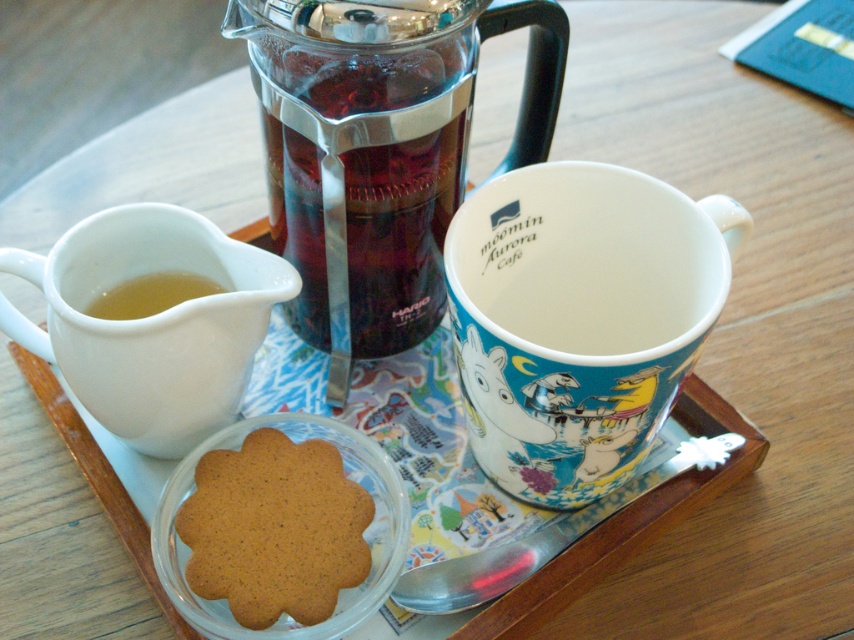
Is point (110, 273) less distant than point (143, 285)?

Yes, it is in front of point (143, 285).

Consider the image. Does white ceramic mug at lower left appear on the right side of translucent glass cup at lower left?

Yes, white ceramic mug at lower left is to the right of translucent glass cup at lower left.

Which is in front, point (98, 236) or point (98, 308)?

Point (98, 236) is more forward.

The width and height of the screenshot is (854, 640). In order to click on white ceramic mug at lower left in this screenshot , I will do `click(150, 323)`.

Does transparent glass tea pot at center have a lesser height compared to white ceramic mug at lower left?

In fact, transparent glass tea pot at center may be taller than white ceramic mug at lower left.

Can you confirm if transparent glass tea pot at center is positioned above white ceramic mug at lower left?

Yes.

Which is behind, point (458, 160) or point (185, 403)?

Positioned behind is point (458, 160).

Find the location of `transparent glass tea pot at center`. transparent glass tea pot at center is located at coordinates (385, 154).

Does white ceramic mug at upper right appear on the left side of translucent glass cup at lower left?

No, white ceramic mug at upper right is not to the left of translucent glass cup at lower left.

Who is lower down, white ceramic mug at upper right or translucent glass cup at lower left?

white ceramic mug at upper right

Where is `white ceramic mug at upper right`? The width and height of the screenshot is (854, 640). white ceramic mug at upper right is located at coordinates (580, 317).

At what (x,y) coordinates should I click in order to perform the action: click on white ceramic mug at upper right. Please return your answer as a coordinate pair (x, y). The image size is (854, 640). Looking at the image, I should click on (580, 317).